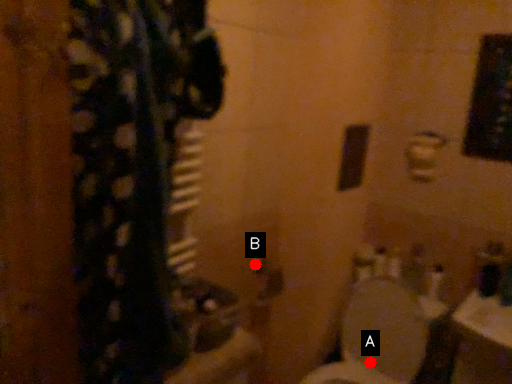
Question: Two points are circled on the image, labeled by A and B beside each circle. Which point appears closest to the camera in this image?

Choices:
 (A) A is closer
 (B) B is closer

Answer: (B)